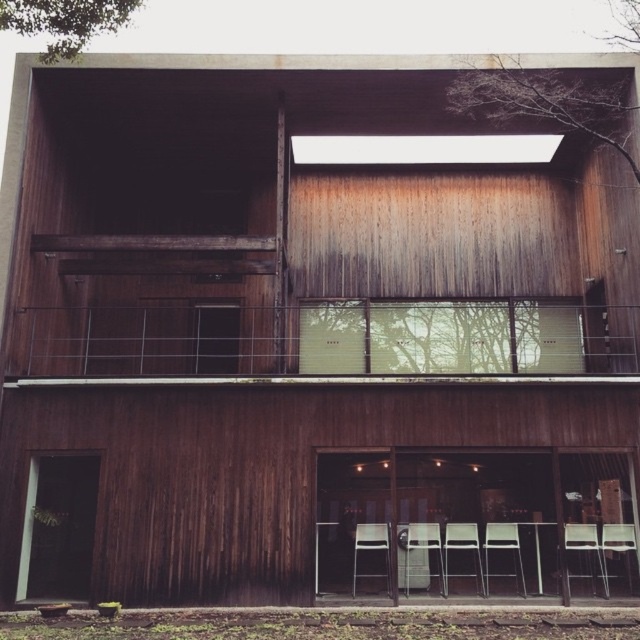
Question: Among these objects, which one is nearest to the camera?

Choices:
 (A) metallic silver chair at lower right
 (B) metallic silver chair at center
 (C) white plastic chair at lower center
 (D) matte wood chair at lower right

Answer: (C)

Question: Does metallic silver chair at center have a greater width compared to metallic silver chair at lower right?

Choices:
 (A) yes
 (B) no

Answer: (A)

Question: Does metallic silver chair at center appear under matte wood chair at lower right?

Choices:
 (A) yes
 (B) no

Answer: (A)

Question: Which point appears farthest from the camera in this image?

Choices:
 (A) (592, 536)
 (B) (420, 538)

Answer: (B)

Question: Is metallic silver chair at center wider than metallic silver chair at lower right?

Choices:
 (A) no
 (B) yes

Answer: (B)

Question: Which of these objects is positioned closest to the metallic silver chair at lower right?

Choices:
 (A) metallic silver chair at center
 (B) matte wood chair at lower right
 (C) white plastic chair at lower center

Answer: (B)